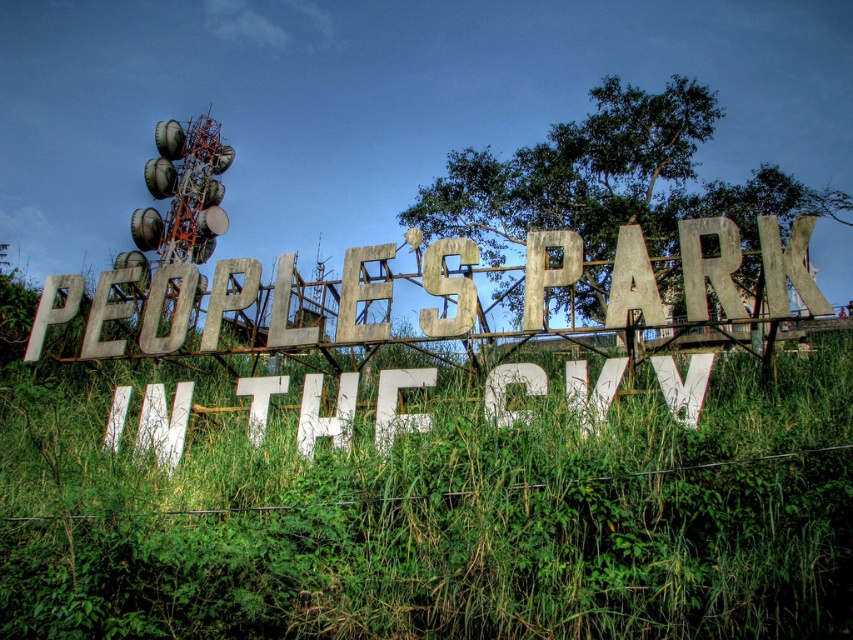
Between point (369, 576) and point (526, 339), which one is positioned behind?

Point (526, 339)

What are the coordinates of `green grass at center` in the screenshot? It's located at (437, 515).